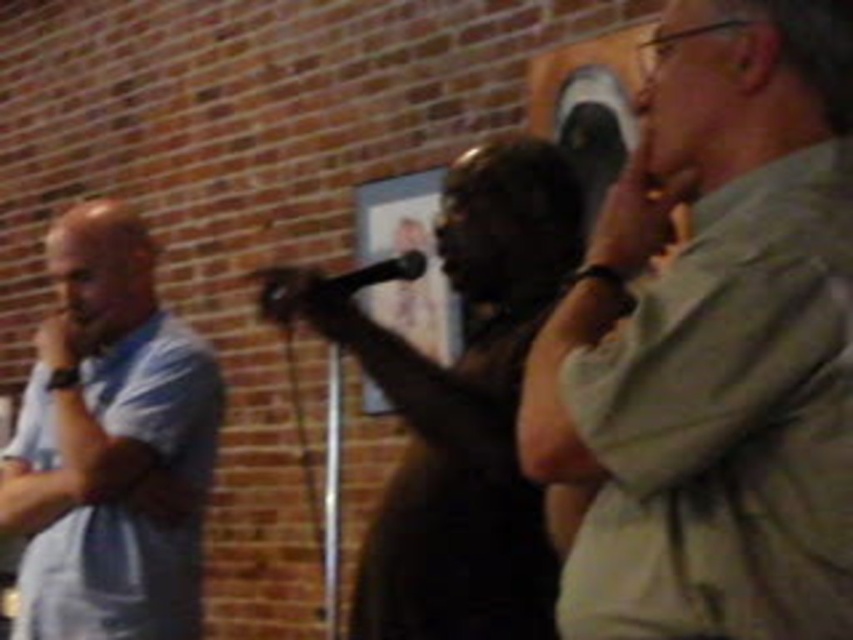
Question: Is light khaki shirt at right further to the viewer compared to light blue shirt at left?

Choices:
 (A) yes
 (B) no

Answer: (B)

Question: Is matte black dress at center to the right of black plastic microphone at center from the viewer's perspective?

Choices:
 (A) yes
 (B) no

Answer: (A)

Question: In this image, where is matte black dress at center located relative to black plastic microphone at center?

Choices:
 (A) above
 (B) below

Answer: (B)

Question: Considering the real-world distances, which object is closest to the matte black dress at center?

Choices:
 (A) black plastic microphone at center
 (B) light blue shirt at left
 (C) light khaki shirt at right

Answer: (A)

Question: Which object appears closest to the camera in this image?

Choices:
 (A) black plastic microphone at center
 (B) matte black dress at center

Answer: (B)

Question: Which of the following is the closest to the observer?

Choices:
 (A) (801, 326)
 (B) (459, 266)
 (C) (71, 602)

Answer: (A)